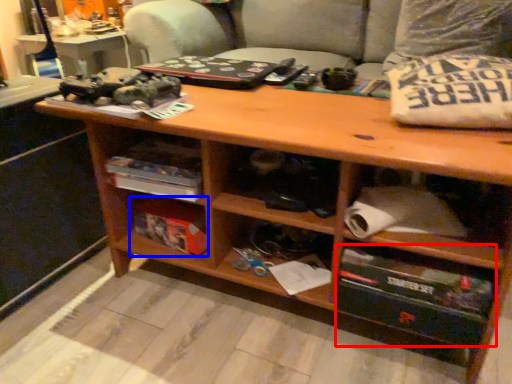
Question: Which point is closer to the camera, drawer (highlighted by a red box) or box (highlighted by a blue box)?

Choices:
 (A) drawer
 (B) box

Answer: (A)